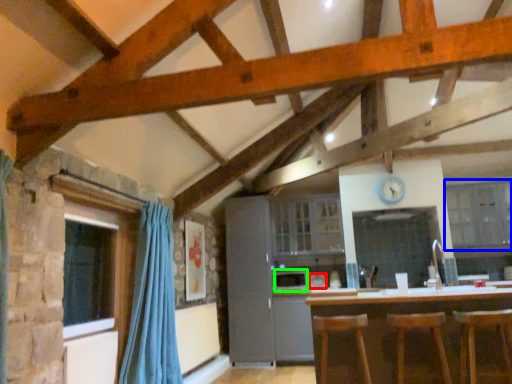
Question: Which is farther away from appliance (highlighted by a red box)? cabinetry (highlighted by a blue box) or appliance (highlighted by a green box)?

Choices:
 (A) cabinetry
 (B) appliance

Answer: (A)